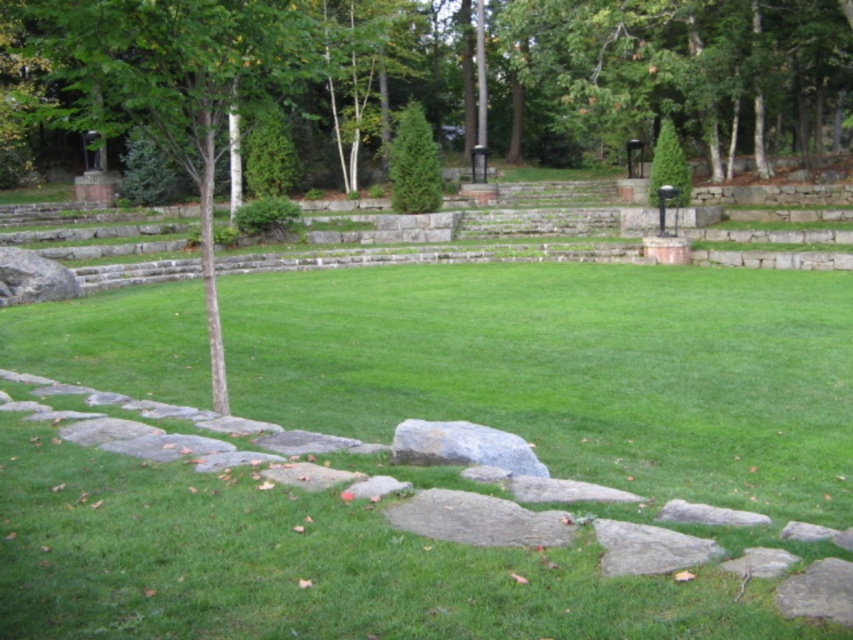
Question: Can you confirm if green smooth tree at left is smaller than gray/rough rock at center?

Choices:
 (A) no
 (B) yes

Answer: (A)

Question: Does green smooth tree at left have a lesser width compared to gray/rough rock at center?

Choices:
 (A) yes
 (B) no

Answer: (B)

Question: Does green smooth tree at left have a lesser width compared to gray/rough rock at center?

Choices:
 (A) no
 (B) yes

Answer: (A)

Question: Which point is closer to the camera taking this photo?

Choices:
 (A) (465, 440)
 (B) (9, 4)

Answer: (A)